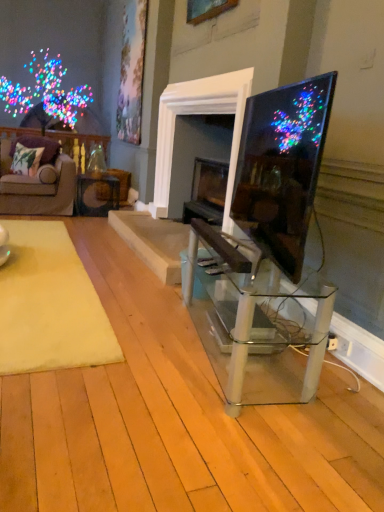
Question: From the image's perspective, is matte black table at center, acting as the second table starting from the right, below velvet purple couch at left?

Choices:
 (A) no
 (B) yes

Answer: (B)

Question: From the image's perspective, does matte black table at center, acting as the second table starting from the right, appear higher than velvet purple couch at left?

Choices:
 (A) no
 (B) yes

Answer: (A)

Question: Is the surface of matte black table at center, which appears as the 2th table when viewed from the front, in direct contact with velvet purple couch at left?

Choices:
 (A) no
 (B) yes

Answer: (A)

Question: Considering the relative sizes of matte black table at center, placed as the 1th table when sorted from top to bottom, and velvet purple couch at left in the image provided, is matte black table at center, placed as the 1th table when sorted from top to bottom, wider than velvet purple couch at left?

Choices:
 (A) no
 (B) yes

Answer: (A)

Question: Considering the relative sizes of matte black table at center, placed as the 1th table when sorted from top to bottom, and velvet purple couch at left in the image provided, is matte black table at center, placed as the 1th table when sorted from top to bottom, smaller than velvet purple couch at left?

Choices:
 (A) yes
 (B) no

Answer: (A)

Question: From a real-world perspective, is matte black table at center, placed as the 1th table when sorted from back to front, physically above velvet purple couch at left?

Choices:
 (A) no
 (B) yes

Answer: (A)

Question: Could you tell me if velvet purple couch at left is turned towards green floral fabric pillow at left?

Choices:
 (A) yes
 (B) no

Answer: (A)

Question: Considering the relative sizes of velvet purple couch at left and green floral fabric pillow at left in the image provided, is velvet purple couch at left bigger than green floral fabric pillow at left?

Choices:
 (A) yes
 (B) no

Answer: (A)

Question: Is velvet purple couch at left taller than green floral fabric pillow at left?

Choices:
 (A) no
 (B) yes

Answer: (B)

Question: Is velvet purple couch at left thinner than green floral fabric pillow at left?

Choices:
 (A) no
 (B) yes

Answer: (A)

Question: Does velvet purple couch at left touch green floral fabric pillow at left?

Choices:
 (A) no
 (B) yes

Answer: (A)

Question: Is velvet purple couch at left not within green floral fabric pillow at left?

Choices:
 (A) no
 (B) yes

Answer: (B)

Question: Does yellow plush rug at lower left have a greater height compared to matte black table at center, placed as the 1th table when sorted from back to front?

Choices:
 (A) no
 (B) yes

Answer: (A)